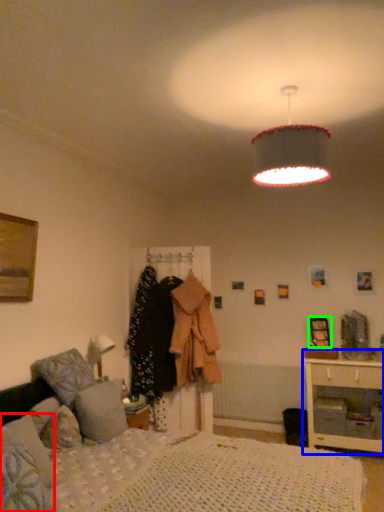
Question: Based on their relative distances, which object is nearer to pillow (highlighted by a red box)? Choose from nightstand (highlighted by a blue box) and picture frame (highlighted by a green box).

Choices:
 (A) nightstand
 (B) picture frame

Answer: (A)